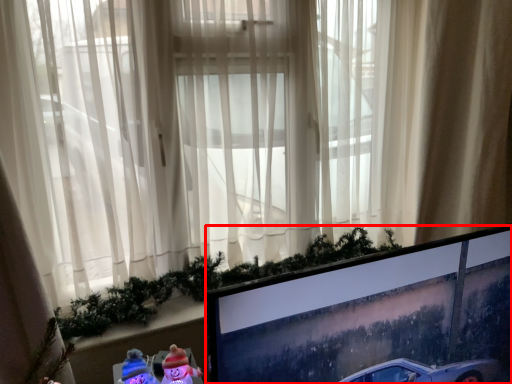
Question: From the image, what is the correct spatial relationship of computer monitor (annotated by the red box) in relation to curtain?

Choices:
 (A) left
 (B) right

Answer: (A)